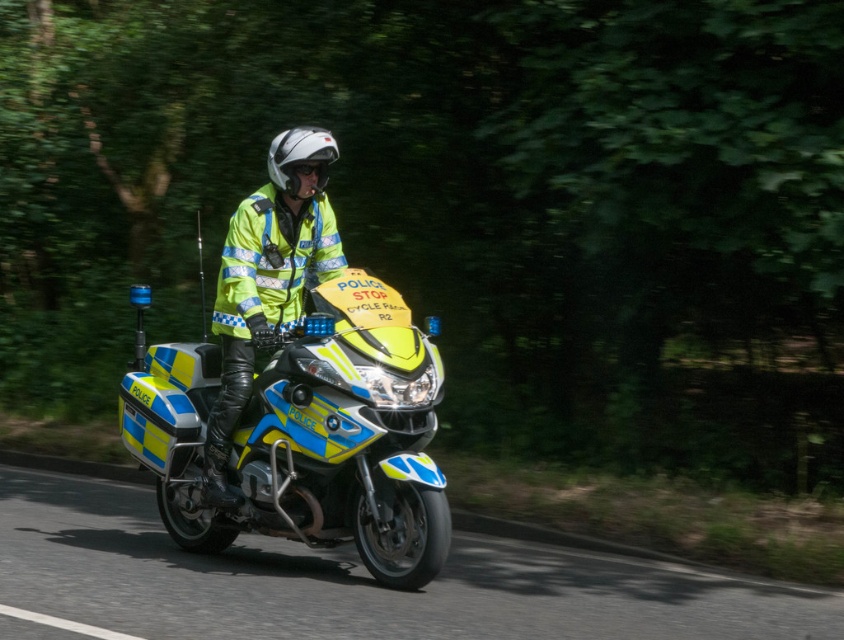
Question: Does blue and yellow plastic motorcycle at center have a smaller size compared to white matte helmet at center?

Choices:
 (A) yes
 (B) no

Answer: (B)

Question: Which object is the closest to the blue and yellow plastic motorcycle at center?

Choices:
 (A) high-visibility reflective jacket at center
 (B) white matte helmet at center

Answer: (A)

Question: Which of the following is the farthest from the observer?

Choices:
 (A) high-visibility reflective jacket at center
 (B) blue and yellow plastic motorcycle at center

Answer: (A)

Question: Can you confirm if blue and yellow plastic motorcycle at center is positioned to the left of high-visibility reflective jacket at center?

Choices:
 (A) yes
 (B) no

Answer: (A)

Question: Among these objects, which one is farthest from the camera?

Choices:
 (A) blue and yellow plastic motorcycle at center
 (B) high-visibility reflective jacket at center

Answer: (B)

Question: Can you confirm if blue and yellow plastic motorcycle at center is wider than white matte helmet at center?

Choices:
 (A) yes
 (B) no

Answer: (A)